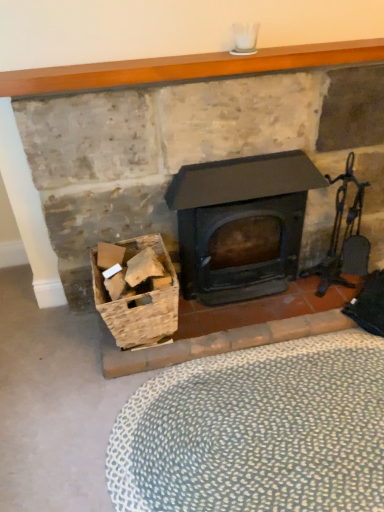
Where is `space that is in front of matte black wood burning stove at center`? The width and height of the screenshot is (384, 512). space that is in front of matte black wood burning stove at center is located at coordinates (254, 352).